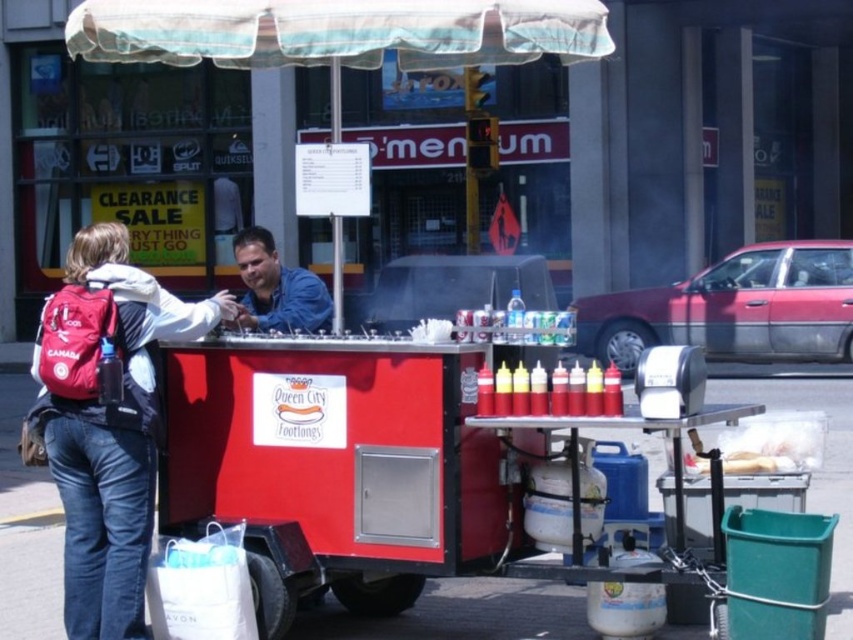
Question: Can you confirm if denim jacket at left is positioned below blue denim shirt at center?

Choices:
 (A) yes
 (B) no

Answer: (A)

Question: Among these points, which one is nearest to the camera?

Choices:
 (A) (61, 408)
 (B) (263, 278)

Answer: (A)

Question: Which of the following is the farthest from the observer?

Choices:
 (A) denim jacket at left
 (B) blue denim shirt at center

Answer: (B)

Question: Does denim jacket at left come in front of blue denim shirt at center?

Choices:
 (A) no
 (B) yes

Answer: (B)

Question: Does denim jacket at left appear over blue denim shirt at center?

Choices:
 (A) yes
 (B) no

Answer: (B)

Question: Which point is closer to the camera?

Choices:
 (A) denim jacket at left
 (B) blue denim shirt at center

Answer: (A)